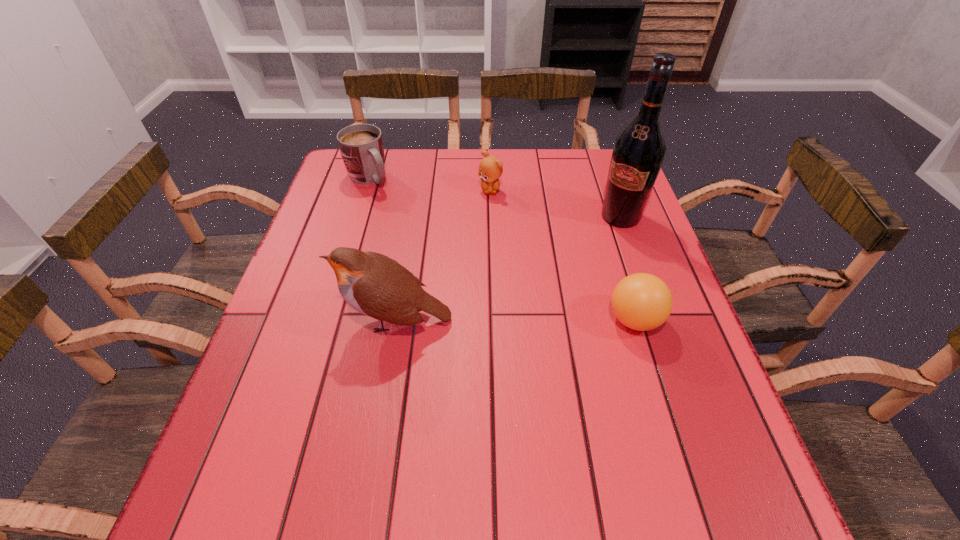
The image size is (960, 540). I want to click on vacant spot on the desktop that is between the bird and the ping-pong ball and is positioned on the face of the third object from right to left, so click(489, 320).

Identify the location of vacant space on the desktop that is between the fourth shortest object and the ping-pong ball and is positioned on the side of the mug with the handle. (515, 320).

This screenshot has height=540, width=960. Identify the location of vacant space on the desktop that is between the bird and the ping-pong ball and is positioned on the label of the third farthest object. (541, 320).